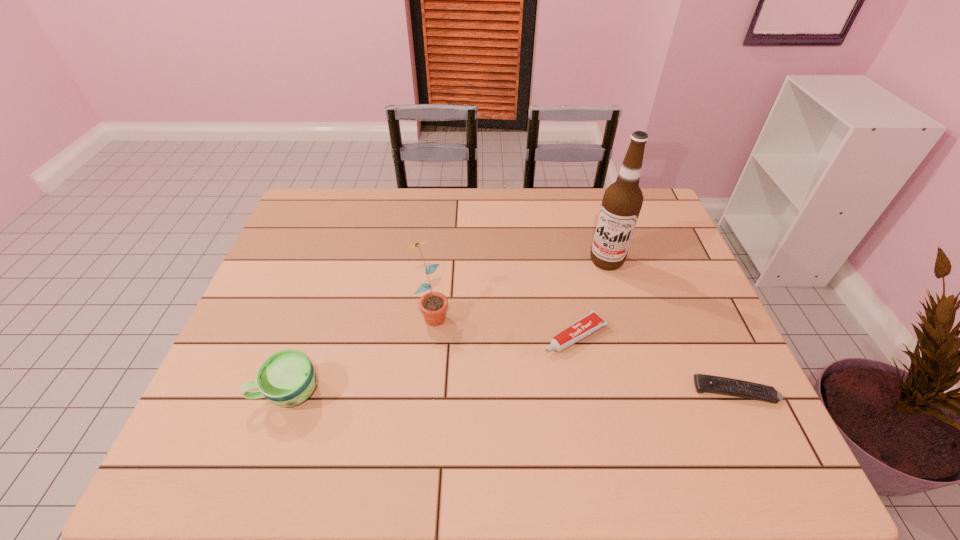
Locate an element on the screen. The image size is (960, 540). blank space at the far left corner of the desktop is located at coordinates (344, 210).

Find the location of a particular element. The height and width of the screenshot is (540, 960). vacant area that lies between the fourth object from right to left and the second shortest object is located at coordinates (503, 324).

The image size is (960, 540). Identify the location of free point between the farthest object and the shortest object. (671, 326).

Identify the location of free space between the tallest object and the toothpaste. (591, 298).

This screenshot has height=540, width=960. What are the coordinates of `unoccupied area between the rightmost object and the tallest object` in the screenshot? It's located at (671, 326).

Locate an element on the screen. vacant space that is in between the third tallest object and the alcohol is located at coordinates (447, 327).

This screenshot has height=540, width=960. I want to click on free spot between the tallest object and the fourth tallest object, so click(x=591, y=298).

Identify the location of free space between the fourth object from right to left and the farthest object. The image size is (960, 540). (518, 287).

Where is `empty location between the sunflower and the farthest object`? This screenshot has width=960, height=540. empty location between the sunflower and the farthest object is located at coordinates (518, 287).

This screenshot has height=540, width=960. What are the coordinates of `blank region between the farthest object and the leftmost object` in the screenshot? It's located at (447, 327).